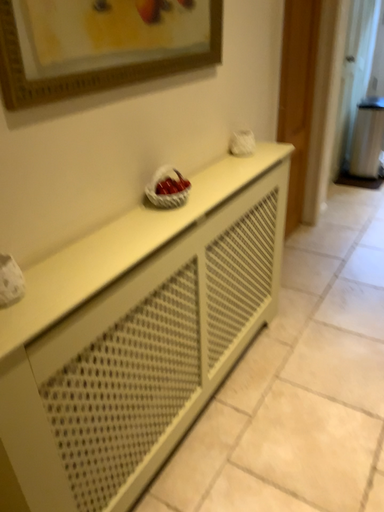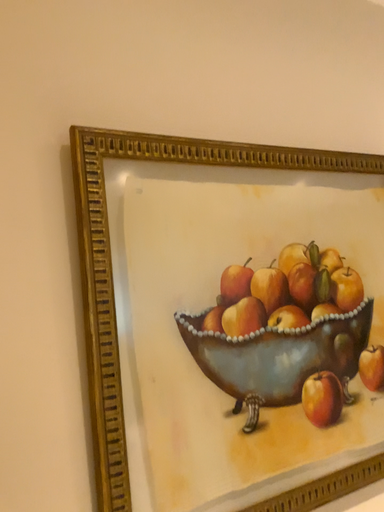
Question: How did the camera likely rotate when shooting the video?

Choices:
 (A) rotated upward
 (B) rotated downward

Answer: (A)